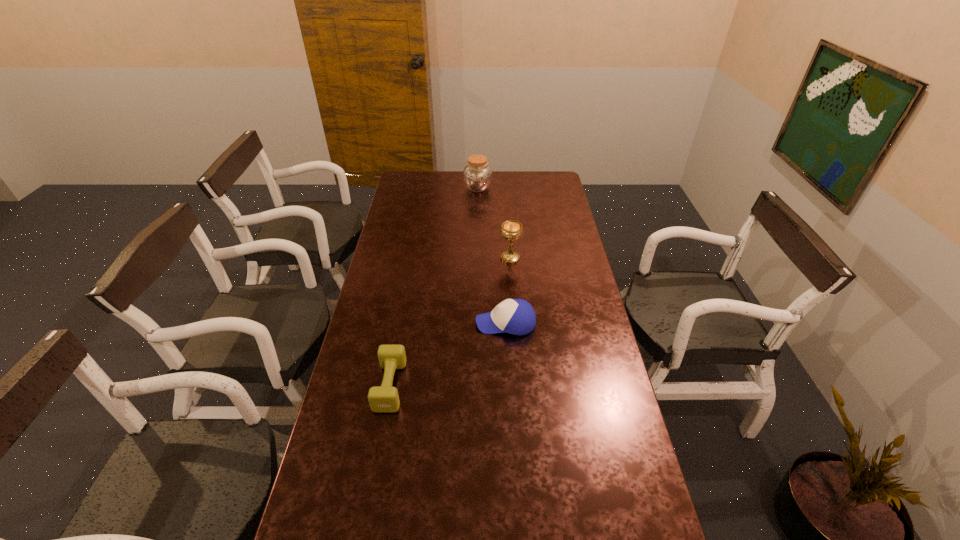
The height and width of the screenshot is (540, 960). What are the coordinates of `vacant area that lies between the dumbbell and the third nearest object` in the screenshot? It's located at (450, 322).

The image size is (960, 540). What are the coordinates of `free area in between the jar and the second farthest object` in the screenshot? It's located at (493, 223).

Image resolution: width=960 pixels, height=540 pixels. I want to click on blank region between the chalice and the leftmost object, so click(450, 322).

The height and width of the screenshot is (540, 960). I want to click on blank region between the leftmost object and the baseball cap, so click(448, 354).

Identify the location of empty space between the jar and the leftmost object. (434, 287).

This screenshot has width=960, height=540. I want to click on vacant space that's between the chalice and the leftmost object, so click(450, 322).

At what (x,y) coordinates should I click in order to perform the action: click on free spot between the baseball cap and the chalice. Please return your answer as a coordinate pair (x, y). This screenshot has width=960, height=540. Looking at the image, I should click on (508, 291).

Where is `object that stands as the third closest to the chalice`? Image resolution: width=960 pixels, height=540 pixels. object that stands as the third closest to the chalice is located at coordinates (382, 399).

Identify which object is the nearest to the farthest object. Please provide its 2D coordinates. Your answer should be formatted as a tuple, i.e. [(x, y)], where the tuple contains the x and y coordinates of a point satisfying the conditions above.

[(511, 230)]